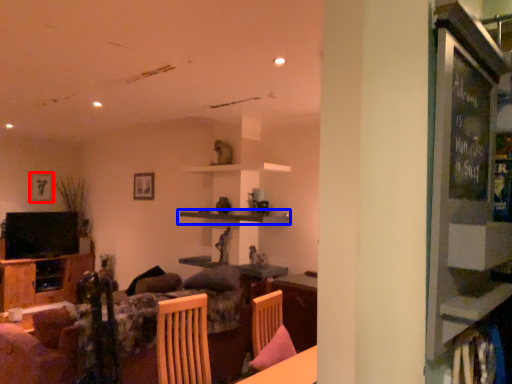
Question: Which point is closer to the camera, picture frame (highlighted by a red box) or shelf (highlighted by a blue box)?

Choices:
 (A) picture frame
 (B) shelf

Answer: (B)